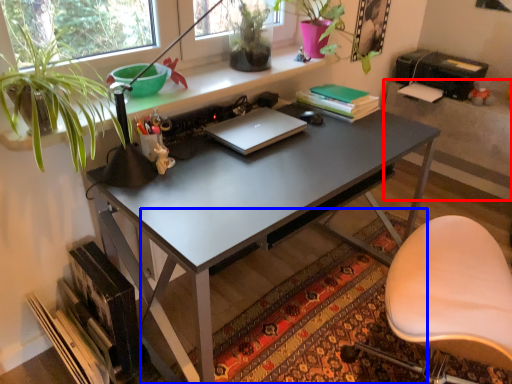
Question: Which of the following is the farthest to the observer, table (highlighted by a red box) or mat (highlighted by a blue box)?

Choices:
 (A) table
 (B) mat

Answer: (A)